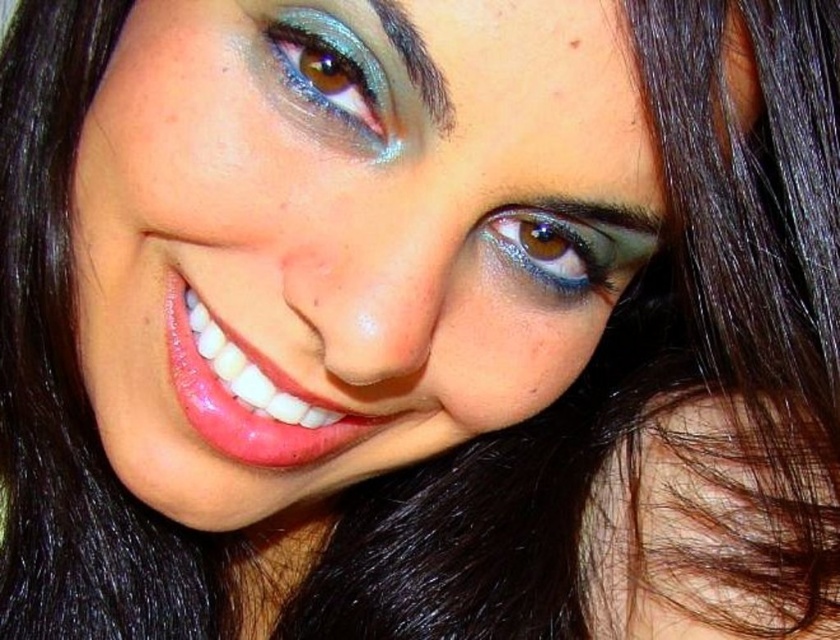
Looking at the person in the image, where is the shiny brown eye at upper center in relation to the sleek dark brown eyebrow at upper center?

The shiny brown eye at upper center is located to the right of the sleek dark brown eyebrow at upper center.

You are a makeup artist preparing to apply eyeliner on the shiny teal eyeshadow at upper center and the brown matte freckle at upper center. Which area requires more precise application due to its smaller size?

The brown matte freckle at upper center requires more precise application because it is smaller than the shiny teal eyeshadow at upper center.